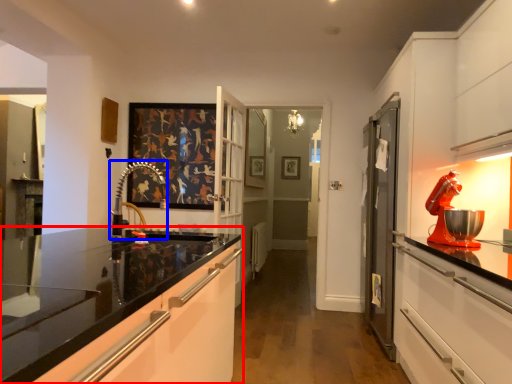
Question: Which object appears closest to the camera in this image, cabinetry (highlighted by a red box) or faucet (highlighted by a blue box)?

Choices:
 (A) cabinetry
 (B) faucet

Answer: (A)